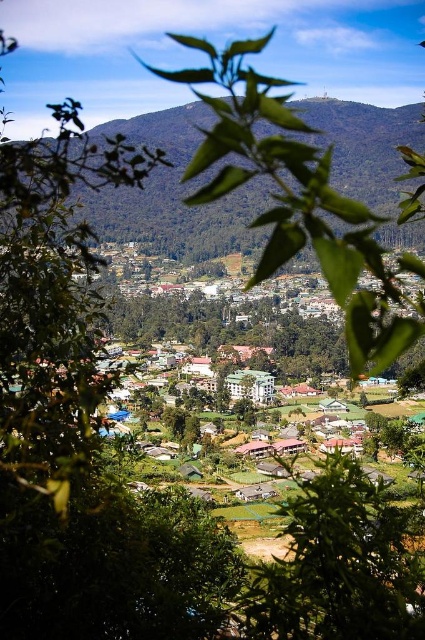
Is point (240, 204) positioned in front of point (305, 593)?

No, (240, 204) is behind (305, 593).

Consider the image. Who is more forward, [408,115] or [282,572]?

Positioned in front is point [282,572].

Locate an element on the screen. green leafy mountain at center is located at coordinates (173, 193).

The width and height of the screenshot is (425, 640). I want to click on green leafy mountain at center, so click(173, 193).